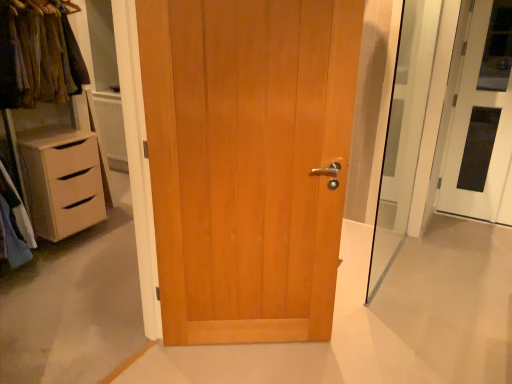
Question: Is transparent glass screen door at right smaller than white glossy door at right, the first door when ordered from back to front?

Choices:
 (A) yes
 (B) no

Answer: (B)

Question: Is transparent glass screen door at right oriented towards white glossy door at right, the 2th door from the front?

Choices:
 (A) yes
 (B) no

Answer: (B)

Question: Is transparent glass screen door at right not close to white glossy door at right, the 2th door from the front?

Choices:
 (A) no
 (B) yes

Answer: (A)

Question: Is transparent glass screen door at right taller than white glossy door at right, the 2th door positioned from the left?

Choices:
 (A) no
 (B) yes

Answer: (B)

Question: Is transparent glass screen door at right shorter than white glossy door at right, the 2th door from the front?

Choices:
 (A) yes
 (B) no

Answer: (B)

Question: Can we say transparent glass screen door at right lies outside white glossy door at right, which ranks as the 1th door in right-to-left order?

Choices:
 (A) yes
 (B) no

Answer: (A)

Question: Is white glossy door at right, the 2th door from the front, positioned far away from transparent glass screen door at right?

Choices:
 (A) yes
 (B) no

Answer: (B)

Question: From the image's perspective, is white glossy door at right, the 2th door positioned from the left, on top of transparent glass screen door at right?

Choices:
 (A) no
 (B) yes

Answer: (B)

Question: Is white glossy door at right, the 2th door from the front, next to transparent glass screen door at right?

Choices:
 (A) yes
 (B) no

Answer: (B)

Question: Does white glossy door at right, which ranks as the 1th door in right-to-left order, have a greater height compared to transparent glass screen door at right?

Choices:
 (A) no
 (B) yes

Answer: (A)

Question: From a real-world perspective, is white glossy door at right, the 2th door from the front, on top of transparent glass screen door at right?

Choices:
 (A) no
 (B) yes

Answer: (B)

Question: Is white glossy door at right, the 2th door positioned from the left, thinner than transparent glass screen door at right?

Choices:
 (A) no
 (B) yes

Answer: (B)

Question: Does light brown wood door at center, the first door when ordered from front to back, come behind white glossy door at right, which ranks as the 1th door in right-to-left order?

Choices:
 (A) yes
 (B) no

Answer: (B)